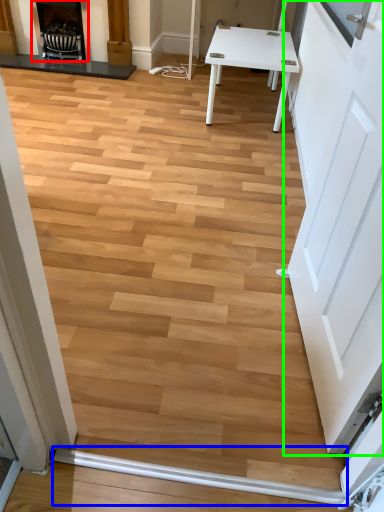
Question: Which object is positioned farthest from fireplace (highlighted by a red box)? Select from beam (highlighted by a blue box) and door (highlighted by a green box).

Choices:
 (A) beam
 (B) door

Answer: (A)